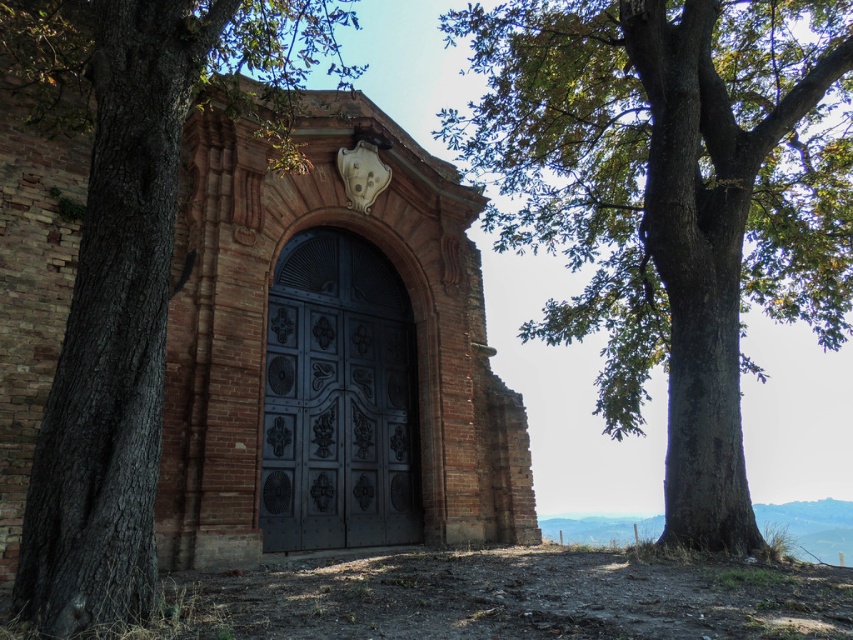
You are a painter wanting to capture the scene of the green leafy tree at center and the dark metal door at center in your artwork. Which object should you focus on if you want to paint the wider one?

The dark metal door at center is wider than the green leafy tree at center, so you should focus on the dark metal door at center.

You are a painter planning to sketch the two trees in the scene. The green leafy tree at center and the brown rough bark tree at left are both in your view. Which tree should you focus on first if you want to capture the one closer to you?

The green leafy tree at center is closer to you than the brown rough bark tree at left, so you should focus on the green leafy tree at center first.